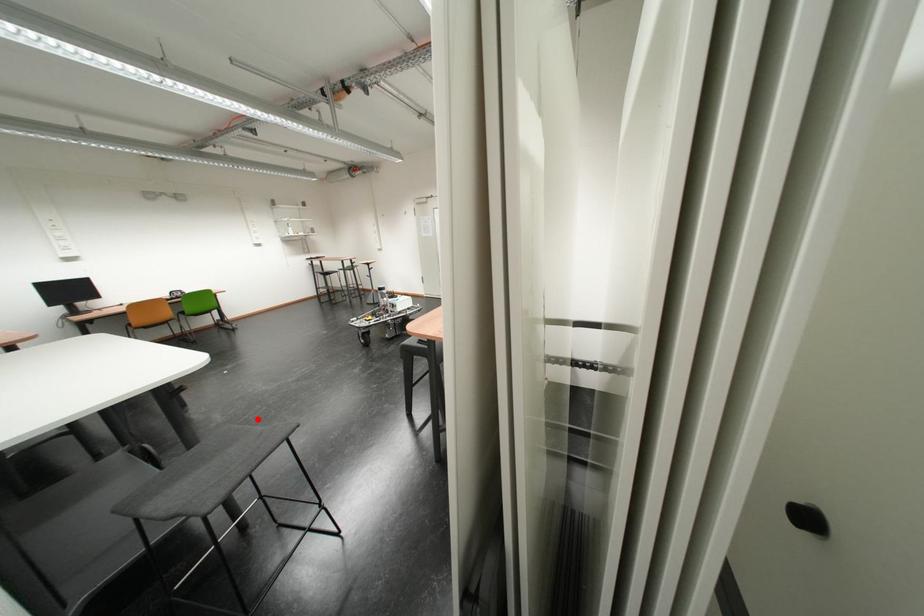
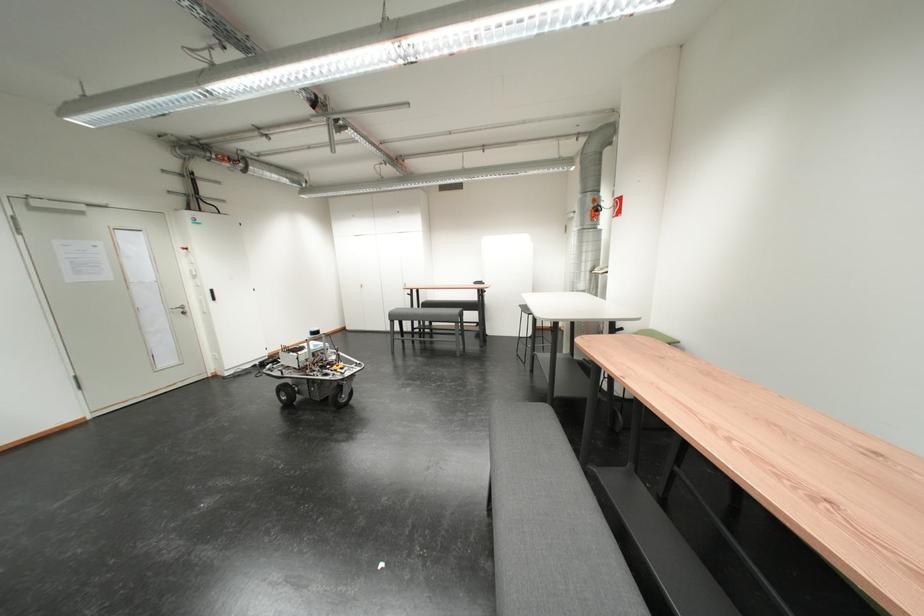
Where in the second image is the point corresponding to the highlighted location from the first image?

(494, 419)